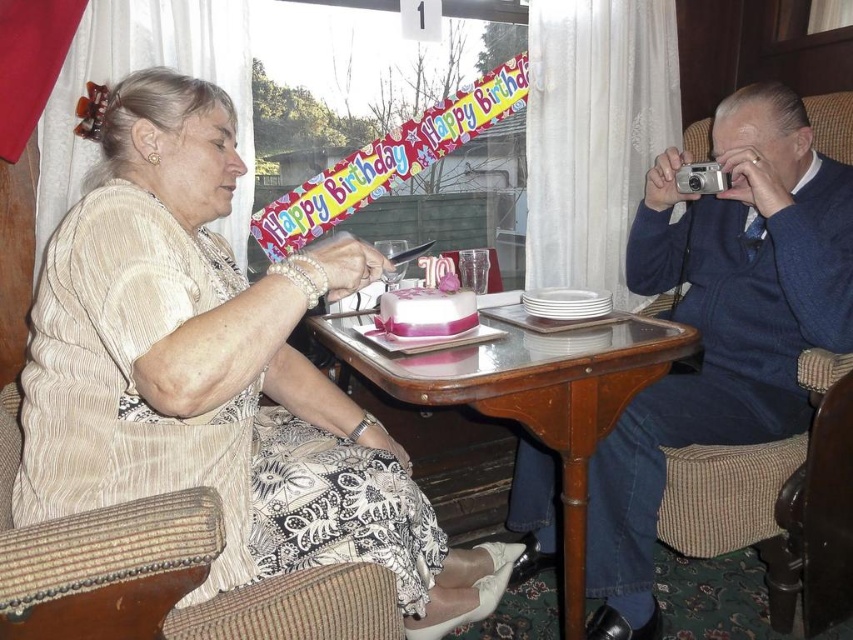
Question: Among these points, which one is farthest from the camera?

Choices:
 (A) (437, 308)
 (B) (456, 364)
 (C) (753, 252)

Answer: (C)

Question: Does matte beige blouse at upper left have a larger size compared to wooden table at center?

Choices:
 (A) no
 (B) yes

Answer: (B)

Question: Among these objects, which one is farthest from the camera?

Choices:
 (A) blue sweater at right
 (B) smooth pink cake at center
 (C) wooden table at center
 (D) matte beige blouse at upper left

Answer: (A)

Question: Does blue sweater at right have a greater width compared to wooden table at center?

Choices:
 (A) no
 (B) yes

Answer: (A)

Question: Which point is closer to the camera?

Choices:
 (A) smooth pink cake at center
 (B) matte beige blouse at upper left
 (C) blue sweater at right

Answer: (B)

Question: Does matte beige blouse at upper left come behind blue sweater at right?

Choices:
 (A) no
 (B) yes

Answer: (A)